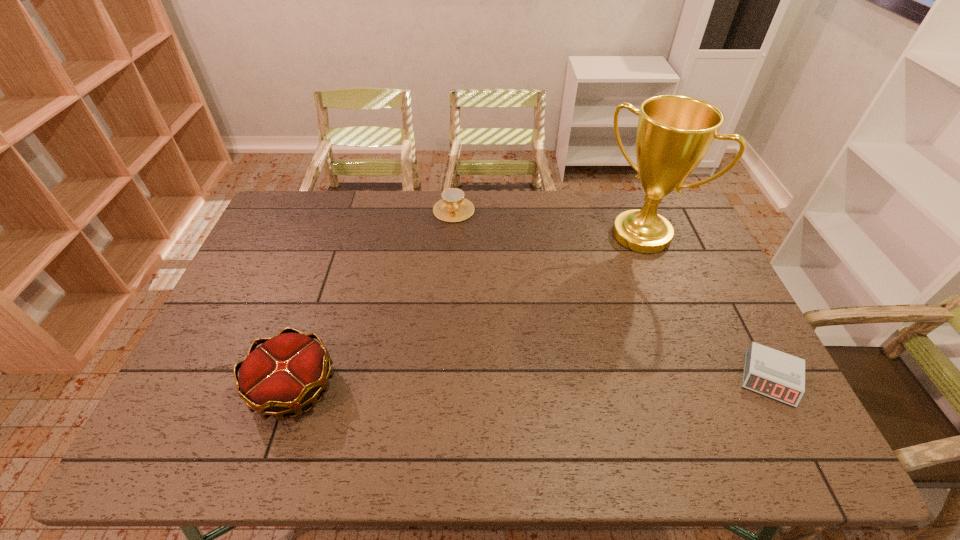
This screenshot has width=960, height=540. What are the coordinates of `free space between the cup and the tallest object` in the screenshot? It's located at (547, 222).

Locate an element on the screen. This screenshot has height=540, width=960. free point between the cup and the tallest object is located at coordinates (547, 222).

Where is `free area in between the cup and the shortest object`? free area in between the cup and the shortest object is located at coordinates (612, 294).

Identify the location of vacant area between the second shortest object and the award. (547, 222).

Locate an element on the screen. The image size is (960, 540). free space between the leftmost object and the shortest object is located at coordinates (532, 383).

Image resolution: width=960 pixels, height=540 pixels. I want to click on vacant space that's between the second tallest object and the shortest object, so point(532,383).

Point out which object is positioned as the second nearest to the second object from left to right. Please provide its 2D coordinates. Your answer should be formatted as a tuple, i.e. [(x, y)], where the tuple contains the x and y coordinates of a point satisfying the conditions above.

[(288, 371)]

Locate which object ranks third in proximity to the leftmost object. Please provide its 2D coordinates. Your answer should be formatted as a tuple, i.e. [(x, y)], where the tuple contains the x and y coordinates of a point satisfying the conditions above.

[(778, 375)]

Where is `free space that satisfies the following two spatial constraints: 1. on the back side of the award; 2. on the left side of the leftmost object`? The width and height of the screenshot is (960, 540). free space that satisfies the following two spatial constraints: 1. on the back side of the award; 2. on the left side of the leftmost object is located at coordinates (344, 234).